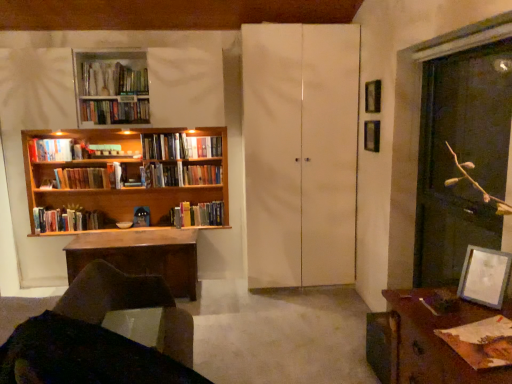
Question: Is transparent glass screen door at right, arranged as the first screen door when viewed from the right, inside the boundaries of metallic silver picture frame at upper right, arranged as the 2th picture frame when ordered from the bottom, or outside?

Choices:
 (A) outside
 (B) inside

Answer: (A)

Question: From a real-world perspective, relative to metallic silver picture frame at upper right, which ranks as the 3th picture frame in front-to-back order, is transparent glass screen door at right, which ranks as the 2th screen door in left-to-right order, vertically above or below?

Choices:
 (A) below
 (B) above

Answer: (A)

Question: Estimate the real-world distances between objects in this image. Which object is closer to the hardcover books at upper left, marked as the third book in a front-to-back arrangement?

Choices:
 (A) transparent glass screen door at right, marked as the second screen door in a back-to-front arrangement
 (B) wooden spoon at upper left, the 2th book viewed from the front
 (C) hardcover book at upper left, arranged as the 4th book when viewed from the front
 (D) brown wooden desk at lower right
 (E) white matte cabinet at center, which is the 2th screen door from right to left

Answer: (B)

Question: Which of these objects is positioned farthest from the brown leather chair at lower left?

Choices:
 (A) hardcover books at left, the 3th book when ordered from back to front
 (B) hardcover books at left, arranged as the 5th book when viewed from the back
 (C) hardcover book at upper left, arranged as the 6th book when viewed from the back
 (D) wooden bookcase at left
 (E) transparent glass screen door at right, placed as the first screen door when sorted from front to back

Answer: (C)